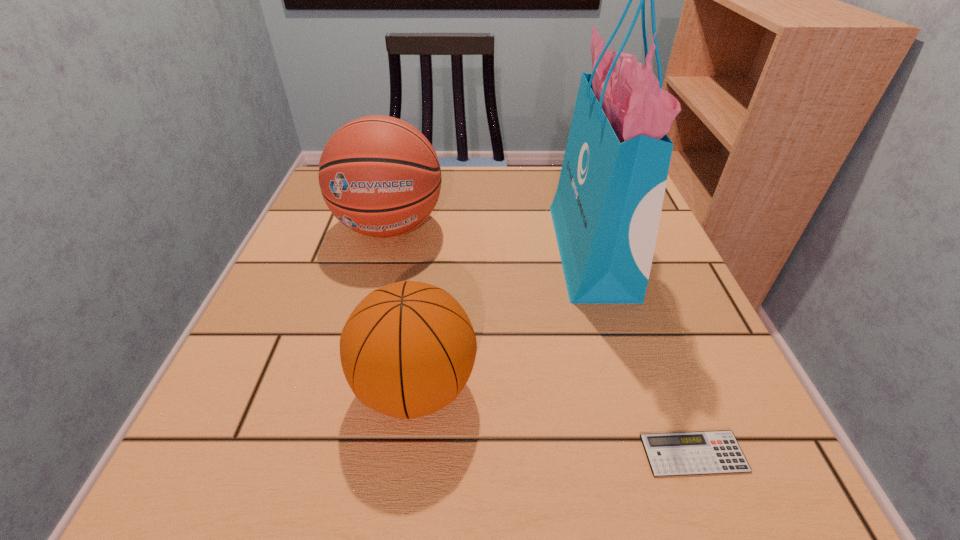
The height and width of the screenshot is (540, 960). I want to click on free spot that satisfies the following two spatial constraints: 1. on the logo side of the calculator; 2. on the left side of the second tallest object, so click(x=331, y=454).

Where is `free space in the image that satisfies the following two spatial constraints: 1. on the logo side of the calculator; 2. on the left side of the taller basketball`? The width and height of the screenshot is (960, 540). free space in the image that satisfies the following two spatial constraints: 1. on the logo side of the calculator; 2. on the left side of the taller basketball is located at coordinates (331, 454).

You are a GUI agent. You are given a task and a screenshot of the screen. Output one action in this format:
    pyautogui.click(x=<x>, y=<y>)
    Task: Click on the vacant space that satisfies the following two spatial constraints: 1. on the logo side of the second tallest object; 2. on the left side of the third tallest object
    This screenshot has height=540, width=960.
    Given the screenshot: What is the action you would take?
    pyautogui.click(x=348, y=387)

Identify the location of vacant space that satisfies the following two spatial constraints: 1. on the logo side of the shortest object; 2. on the left side of the farther basketball. This screenshot has width=960, height=540. (331, 454).

Identify the location of free location that satisfies the following two spatial constraints: 1. on the logo side of the taller basketball; 2. on the right side of the shopping bag. The image size is (960, 540). (383, 251).